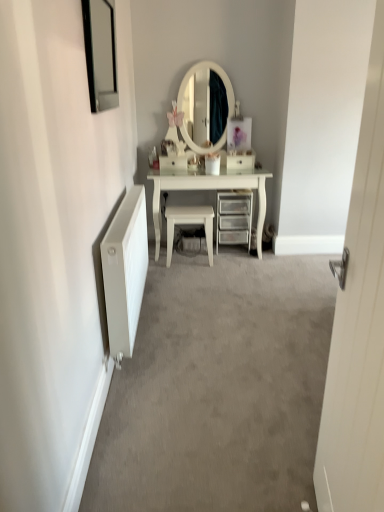
Question: Is white matte radiator at left positioned with its back to white glossy stool at center?

Choices:
 (A) no
 (B) yes

Answer: (A)

Question: Is white matte radiator at left smaller than white glossy stool at center?

Choices:
 (A) yes
 (B) no

Answer: (B)

Question: Is white matte radiator at left bigger than white glossy stool at center?

Choices:
 (A) no
 (B) yes

Answer: (B)

Question: Is white matte radiator at left oriented towards white glossy stool at center?

Choices:
 (A) yes
 (B) no

Answer: (B)

Question: Can you confirm if white matte radiator at left is thinner than white glossy stool at center?

Choices:
 (A) yes
 (B) no

Answer: (A)

Question: Considering the relative sizes of white matte radiator at left and white glossy stool at center in the image provided, is white matte radiator at left shorter than white glossy stool at center?

Choices:
 (A) yes
 (B) no

Answer: (B)

Question: Can you see white radiator at left touching white glossy stool at center?

Choices:
 (A) yes
 (B) no

Answer: (B)

Question: Is white radiator at left outside of white glossy stool at center?

Choices:
 (A) no
 (B) yes

Answer: (B)

Question: Can you confirm if white radiator at left is smaller than white glossy stool at center?

Choices:
 (A) no
 (B) yes

Answer: (A)

Question: From a real-world perspective, is white radiator at left beneath white glossy stool at center?

Choices:
 (A) no
 (B) yes

Answer: (B)

Question: Is white radiator at left to the left of white glossy stool at center from the viewer's perspective?

Choices:
 (A) yes
 (B) no

Answer: (B)

Question: Does white radiator at left lie behind white glossy stool at center?

Choices:
 (A) yes
 (B) no

Answer: (B)

Question: Is clear plastic drawers at center shorter than white wooden door at right?

Choices:
 (A) no
 (B) yes

Answer: (B)